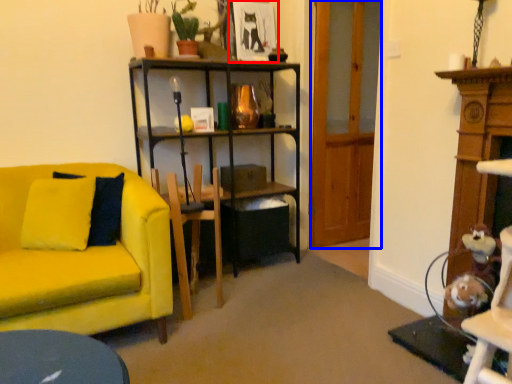
Question: Among these objects, which one is nearest to the camera, picture frame (highlighted by a red box) or glass door (highlighted by a blue box)?

Choices:
 (A) picture frame
 (B) glass door

Answer: (B)